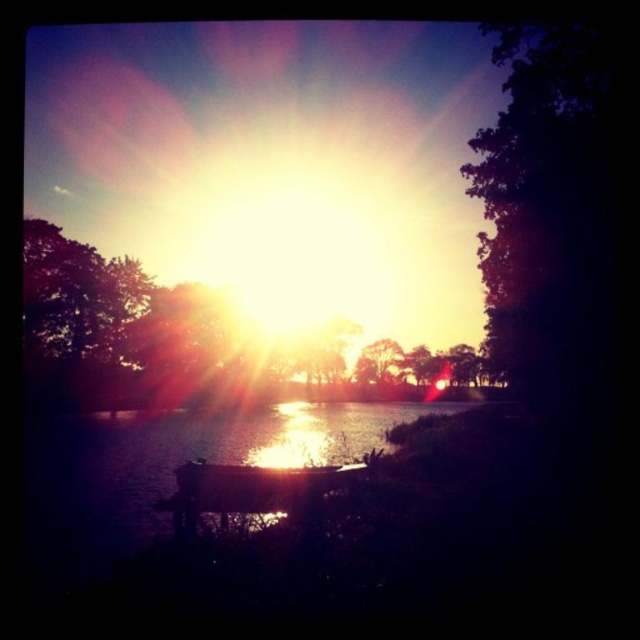
Who is positioned more to the left, glistening reflective water at center or metallic silver boat at center?

Positioned to the left is glistening reflective water at center.

Who is taller, glistening reflective water at center or metallic silver boat at center?

Standing taller between the two is glistening reflective water at center.

What do you see at coordinates (189, 458) in the screenshot?
I see `glistening reflective water at center` at bounding box center [189, 458].

Locate an element on the screen. glistening reflective water at center is located at coordinates (189, 458).

From the picture: Which is below, silvery metallic tree at center or glistening reflective water at center?

glistening reflective water at center is below.

Is silvery metallic tree at center thinner than glistening reflective water at center?

Incorrect, silvery metallic tree at center's width is not less than glistening reflective water at center's.

Who is more distant from viewer, (x=93, y=257) or (x=317, y=419)?

Positioned behind is point (x=93, y=257).

Where is `silvery metallic tree at center`? The width and height of the screenshot is (640, 640). silvery metallic tree at center is located at coordinates (195, 342).

Does silvery metallic tree at center have a larger size compared to metallic silver boat at center?

Yes.

Which is in front, point (118, 257) or point (198, 476)?

Positioned in front is point (198, 476).

What are the coordinates of `silvery metallic tree at center` in the screenshot? It's located at pyautogui.click(x=195, y=342).

Image resolution: width=640 pixels, height=640 pixels. Identify the location of silvery metallic tree at center. (195, 342).